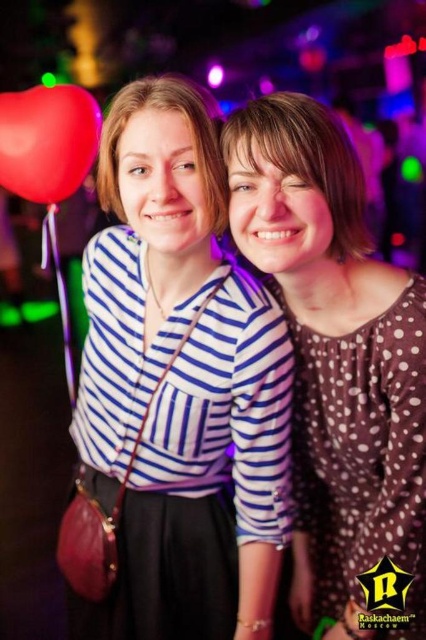
You are at a party and want to take a photo with the two people in the image. You need to position yourself so that you can see both the brown dotted dress at center and the brown polka dot blouse at center clearly. Which side of the two people should you stand to ensure both are visible in your frame?

You should stand to the left side of the two people because the brown dotted dress at center is to the right of the brown polka dot blouse at center. By positioning yourself to the left, both items will be visible in your camera frame.

You are standing at the origin of the coordinate system in the image. You want to move towards the point at the location of point (108, 150). However, there is an obstacle at point (69, 90). Will you collide with the obstacle before reaching your destination?

Point (69, 90) is behind point (108, 150), so you will not collide with the obstacle at point (69, 90) before reaching your destination.